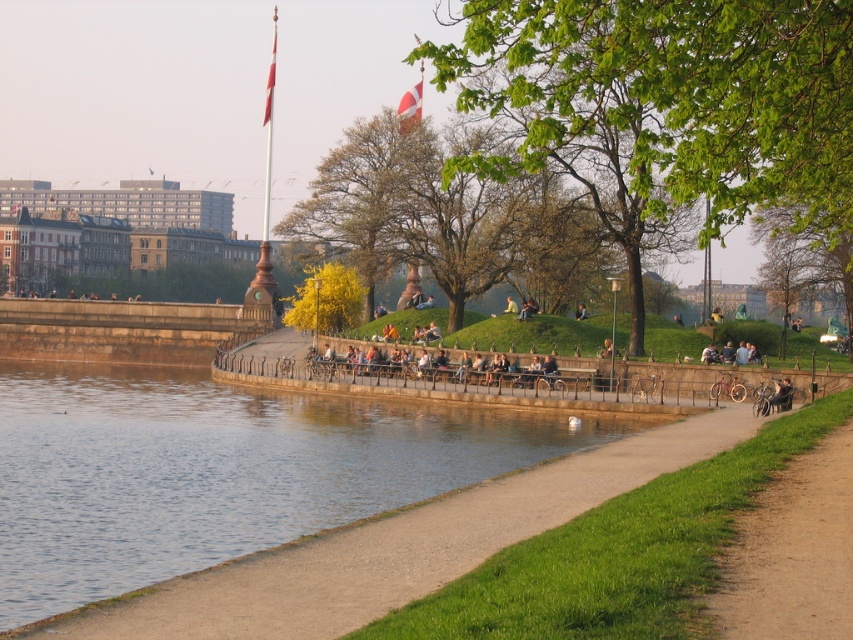
Is clear water at lower left wider than brown dirt path at lower right?

Indeed, clear water at lower left has a greater width compared to brown dirt path at lower right.

Which is in front, point (115, 496) or point (798, 627)?

Point (798, 627) is more forward.

What do you see at coordinates (215, 472) in the screenshot?
I see `clear water at lower left` at bounding box center [215, 472].

Where is `clear water at lower left`? This screenshot has width=853, height=640. clear water at lower left is located at coordinates (215, 472).